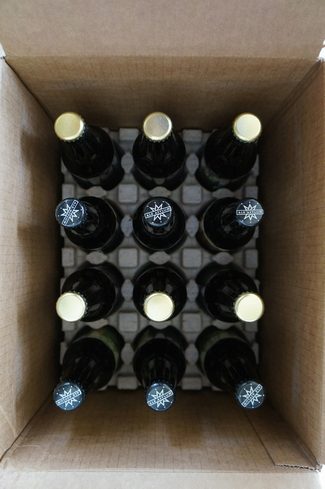
Image resolution: width=325 pixels, height=489 pixels. I want to click on bottles, so click(x=240, y=153), click(x=169, y=356), click(x=247, y=366), click(x=100, y=356), click(x=99, y=287), click(x=178, y=301), click(x=225, y=281), click(x=163, y=241), click(x=104, y=237).